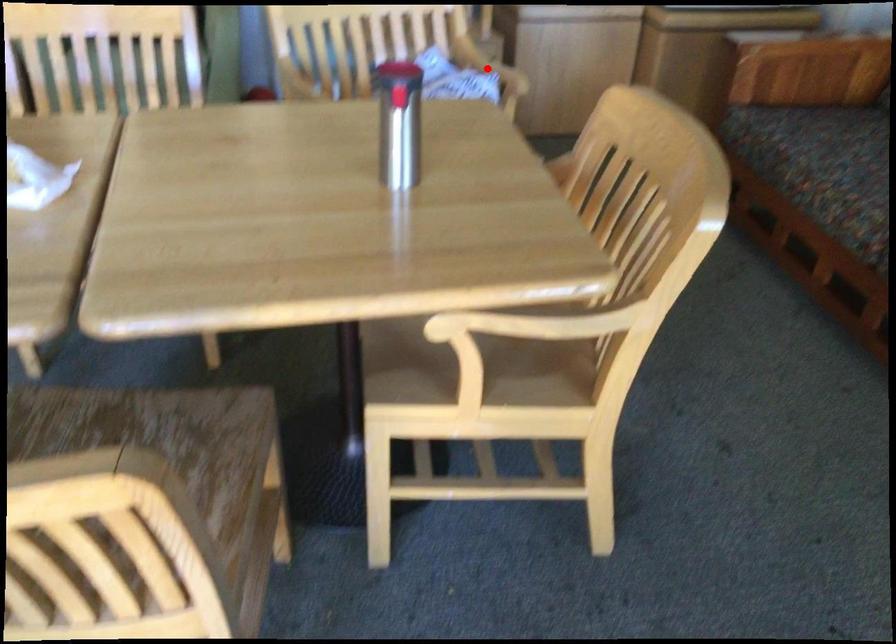
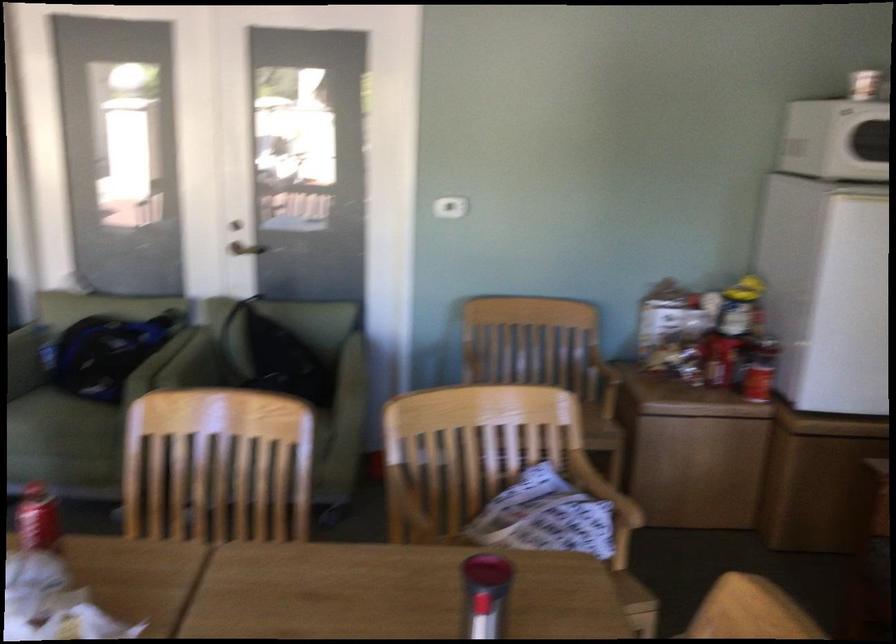
Locate, in the second image, the point that corresponds to the highlighted location in the first image.

(604, 489)